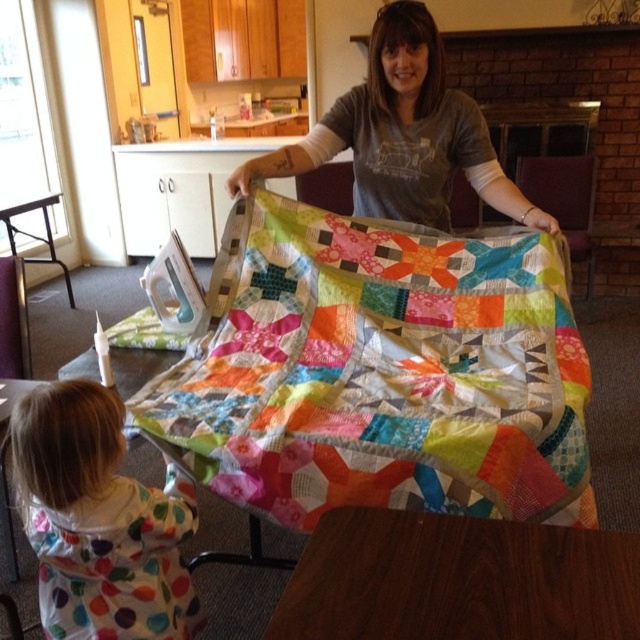
Question: Which point appears farthest from the camera in this image?

Choices:
 (A) (445, 340)
 (B) (492, 625)
 (C) (90, 532)

Answer: (A)

Question: Considering the real-world distances, which object is closest to the matte gray shirt at center?

Choices:
 (A) wooden table at lower left
 (B) wooden table at center
 (C) white polka dot onesie at lower left
 (D) colorful patchwork quilt at center

Answer: (D)

Question: Which point is farther to the camera?

Choices:
 (A) wooden table at lower left
 (B) white polka dot onesie at lower left
 (C) wooden table at center
 (D) matte gray shirt at center

Answer: (D)

Question: Does white polka dot onesie at lower left appear on the left side of wooden table at lower left?

Choices:
 (A) no
 (B) yes

Answer: (A)

Question: Does white polka dot onesie at lower left have a greater width compared to wooden table at lower left?

Choices:
 (A) no
 (B) yes

Answer: (A)

Question: Does colorful patchwork quilt at center appear on the right side of wooden table at center?

Choices:
 (A) yes
 (B) no

Answer: (B)